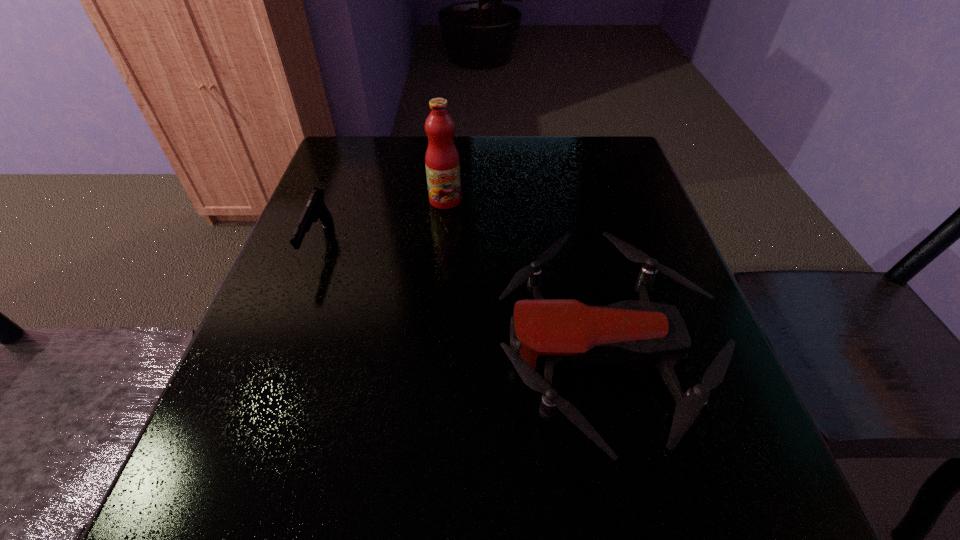
Where is `the second object from left to right`? The width and height of the screenshot is (960, 540). the second object from left to right is located at coordinates (442, 161).

This screenshot has height=540, width=960. What are the coordinates of `the tallest object` in the screenshot? It's located at (442, 161).

Locate an element on the screen. gun is located at coordinates (315, 209).

Identify the location of drone. (555, 334).

The height and width of the screenshot is (540, 960). Identify the location of vacant space located 0.380m on the front label of the farthest object. (432, 343).

The image size is (960, 540). I want to click on free spot located at the aiming end of the leftmost object, so click(231, 475).

At what (x,y) coordinates should I click in order to perform the action: click on vacant position located on the front-facing side of the rightmost object. Please return your answer as a coordinate pair (x, y). The width and height of the screenshot is (960, 540). Looking at the image, I should click on (266, 350).

Locate an element on the screen. The image size is (960, 540). vacant space located 0.050m on the front-facing side of the rightmost object is located at coordinates (468, 350).

The width and height of the screenshot is (960, 540). I want to click on vacant point located on the front-facing side of the rightmost object, so click(405, 350).

The height and width of the screenshot is (540, 960). I want to click on object located at the near edge, so click(555, 334).